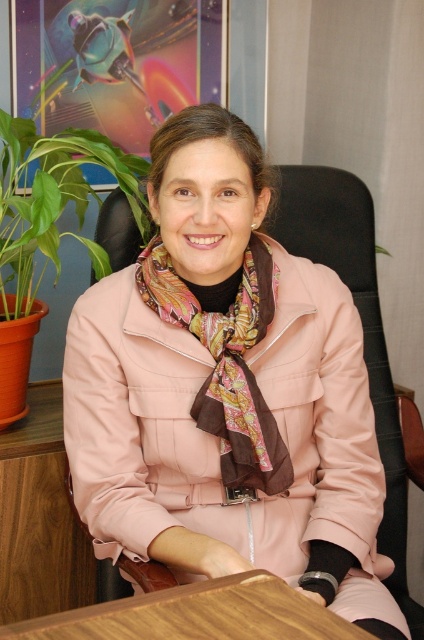
Question: Where is multicolored silk scarf at center located in relation to wooden at center in the image?

Choices:
 (A) left
 (B) right

Answer: (B)

Question: Which object is positioned farthest from the multicolored silk scarf at center?

Choices:
 (A) pink fabric coat at center
 (B) green leafy plant at left
 (C) wooden at center

Answer: (B)

Question: Does multicolored silk scarf at center have a lesser width compared to wooden at center?

Choices:
 (A) no
 (B) yes

Answer: (B)

Question: Which point appears farthest from the camera in this image?

Choices:
 (A) (286, 385)
 (B) (47, 220)
 (C) (253, 449)

Answer: (B)

Question: Is multicolored silk scarf at center wider than wooden at center?

Choices:
 (A) yes
 (B) no

Answer: (B)

Question: Which object appears farthest from the camera in this image?

Choices:
 (A) wooden at center
 (B) pink fabric coat at center

Answer: (B)